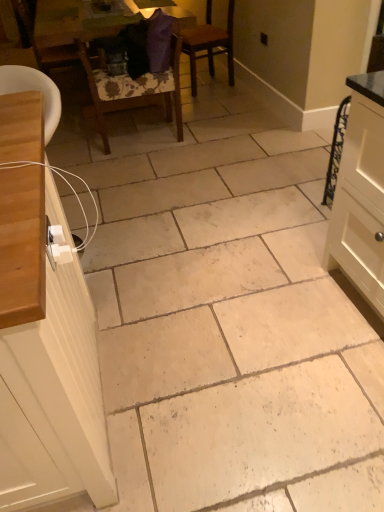
Question: In terms of width, does wooden chair at left, which appears as the 1th chair when viewed from the left, look wider or thinner when compared to brown wooden chair at center, arranged as the first chair when viewed from the right?

Choices:
 (A) thin
 (B) wide

Answer: (B)

Question: In terms of height, does wooden chair at left, which is the third chair in right-to-left order, look taller or shorter compared to brown wooden chair at center, which is the third chair from left to right?

Choices:
 (A) tall
 (B) short

Answer: (A)

Question: Which object is positioned closest to the brown wooden chair at center, arranged as the first chair when viewed from the right?

Choices:
 (A) wooden table at upper center
 (B) wooden chair at left, which appears as the 1th chair when viewed from the left
 (C) wooden chair at center, the 2th chair in the left-to-right sequence
 (D) white matte cabinet at left

Answer: (C)

Question: Estimate the real-world distances between objects in this image. Which object is closer to the white matte cabinet at left?

Choices:
 (A) wooden table at upper center
 (B) wooden chair at left, which is the third chair in right-to-left order
 (C) brown wooden chair at center, arranged as the first chair when viewed from the right
 (D) wooden chair at center, which is counted as the second chair, starting from the right

Answer: (D)